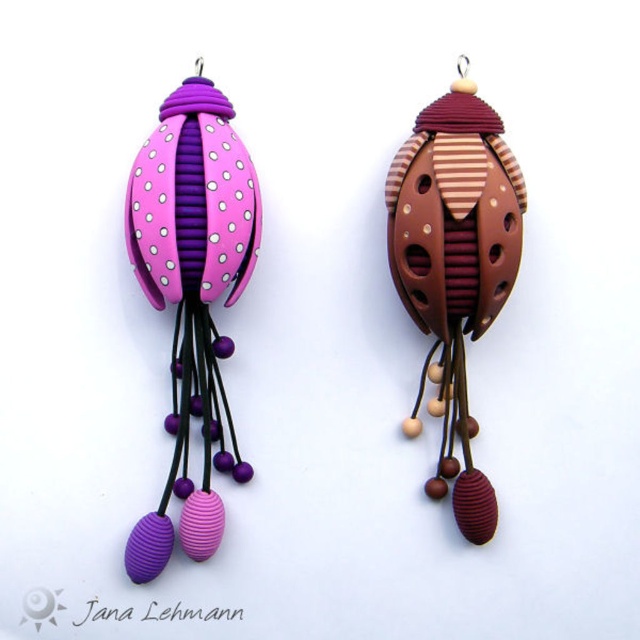
Which is in front, point (216, 454) or point (422, 252)?

Point (422, 252)

Who is taller, matte purple polymer clay earring at left or brown striped polymer clay earring at center?

With more height is matte purple polymer clay earring at left.

Between point (179, 324) and point (397, 252), which one is positioned behind?

Point (179, 324)

Identify the location of matte purple polymer clay earring at left. The height and width of the screenshot is (640, 640). (192, 296).